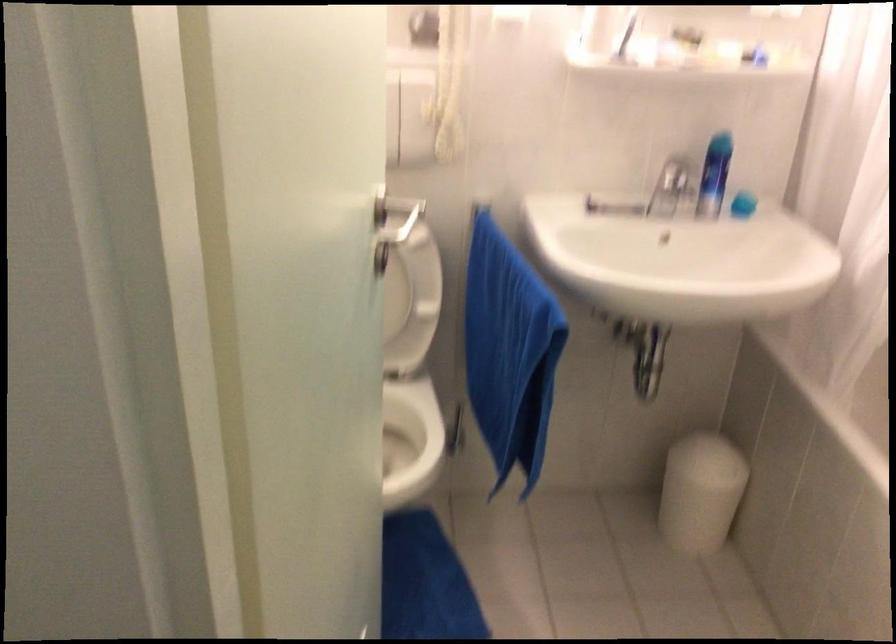
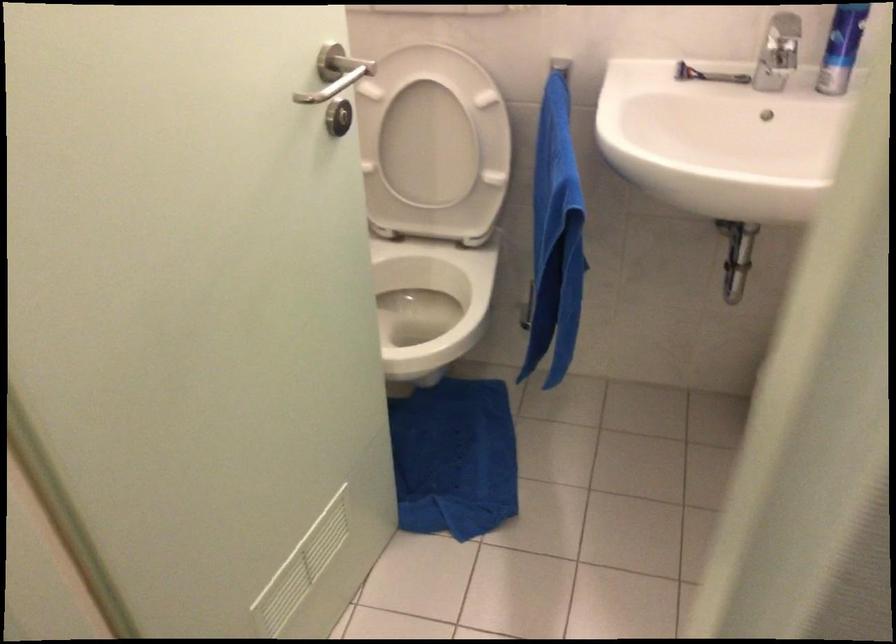
Question: The images are taken continuously from a first-person perspective. In which direction is your viewpoint rotating?

Choices:
 (A) Left
 (B) Right
 (C) Up
 (D) Down

Answer: (A)